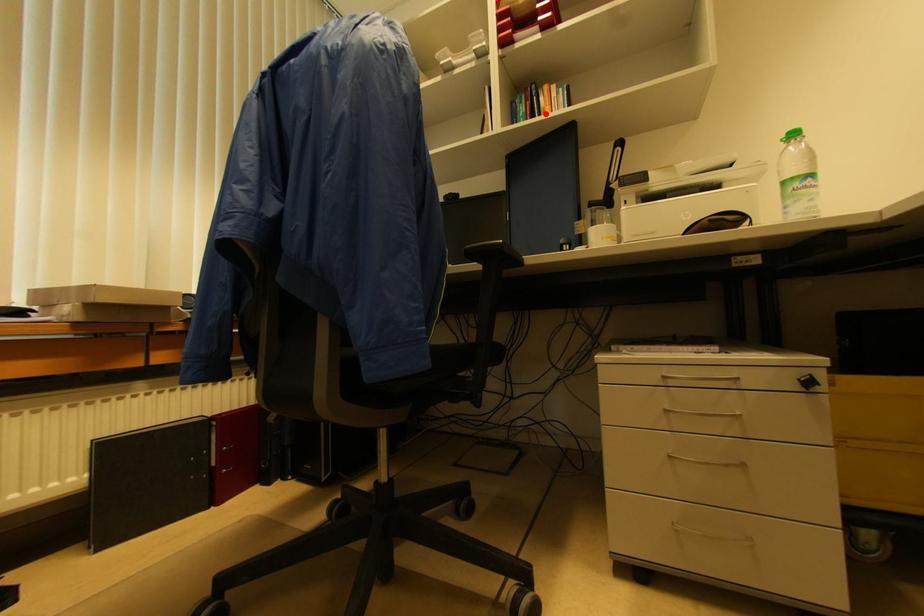
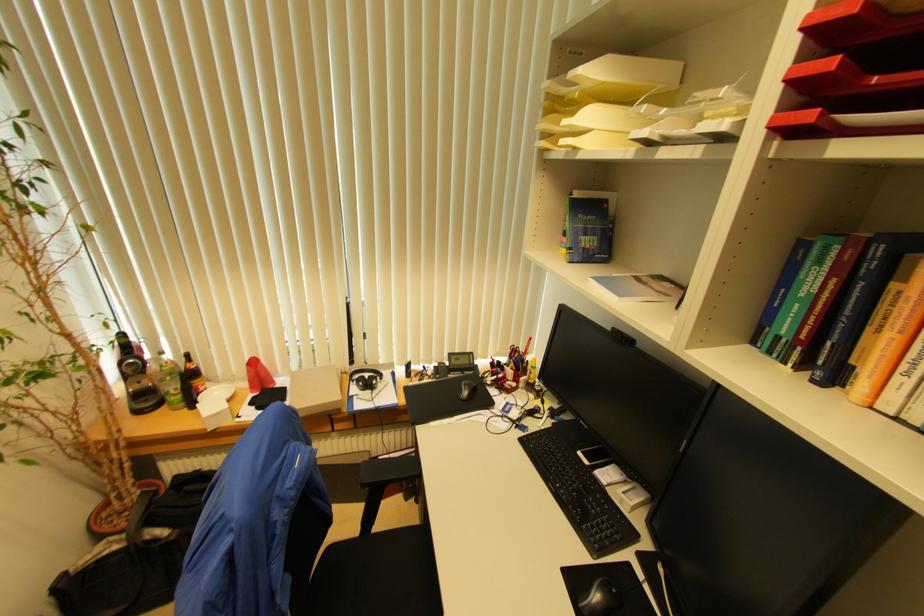
Locate, in the second image, the point that corresponds to the highlighted location in the first image.

(881, 333)